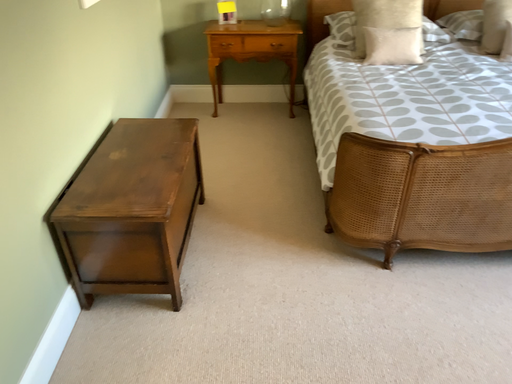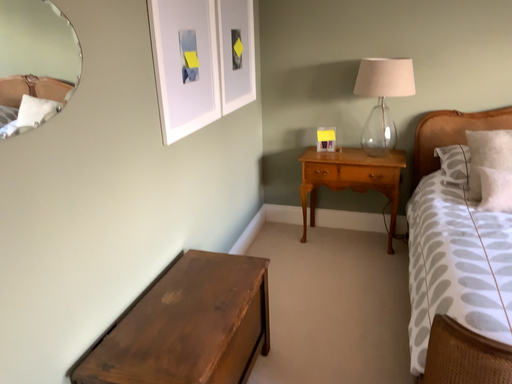
Question: How did the camera likely rotate when shooting the video?

Choices:
 (A) rotated upward
 (B) rotated downward

Answer: (A)